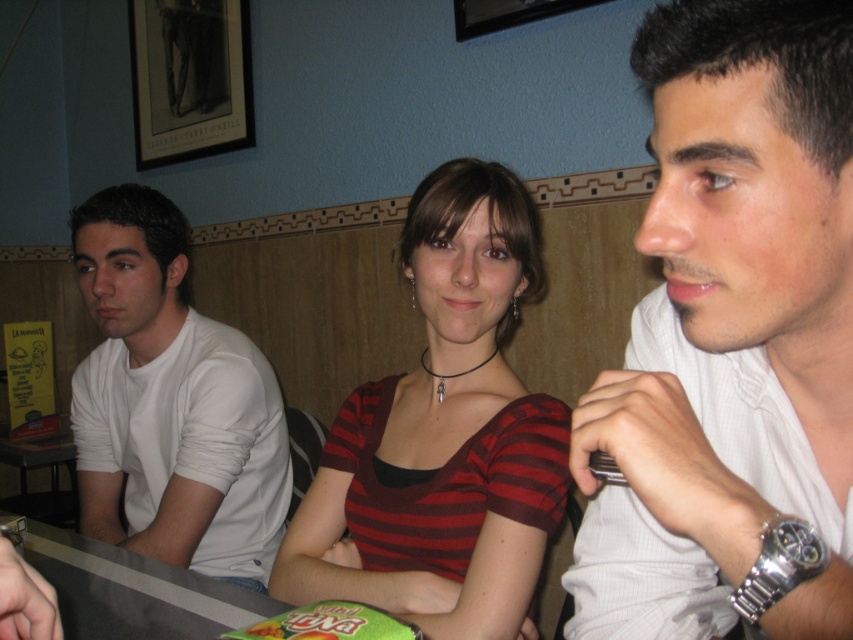
Question: Can you confirm if striped fabric shirt at center is thinner than white matte shirt at left?

Choices:
 (A) no
 (B) yes

Answer: (B)

Question: Considering the real-world distances, which object is closest to the white textured shirt at center?

Choices:
 (A) striped fabric shirt at center
 (B) white matte shirt at left

Answer: (A)

Question: Which object is positioned farthest from the white matte shirt at left?

Choices:
 (A) striped fabric shirt at center
 (B) white textured shirt at center

Answer: (B)

Question: Observing the image, what is the correct spatial positioning of white textured shirt at center in reference to striped fabric shirt at center?

Choices:
 (A) left
 (B) right

Answer: (B)

Question: Which point appears farthest from the camera in this image?

Choices:
 (A) (112, 214)
 (B) (544, 444)

Answer: (A)

Question: Does white textured shirt at center appear on the left side of white matte shirt at left?

Choices:
 (A) yes
 (B) no

Answer: (B)